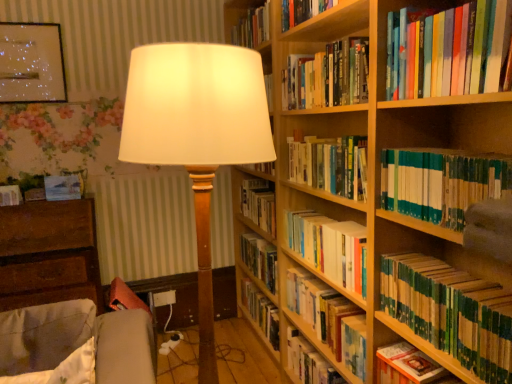
Question: Choose the correct answer: Is hardcover books at center, which is the fourth book in top-to-bottom order, inside wooden bookcase at right or outside it?

Choices:
 (A) inside
 (B) outside

Answer: (A)

Question: In terms of width, does hardcover books at center, which appears as the fifth book when ordered from the bottom, look wider or thinner when compared to wooden bookcase at right?

Choices:
 (A) wide
 (B) thin

Answer: (B)

Question: Which object is the farthest from the metallic silver frame at upper left?

Choices:
 (A) hardcover book at center, positioned as the 3th book in bottom-to-top order
 (B) hardcover book at upper right, the 1th book from the top
 (C) wooden bookcase at right
 (D) hardcover books at center, the seventh book positioned from the bottom
 (E) brown wooden chest of drawers at lower left

Answer: (B)

Question: Which object is the closest to the metallic silver frame at upper left?

Choices:
 (A) hardcover book at center, the 8th book viewed from the top
 (B) hardcover book at lower right, the seventh book in the top-to-bottom sequence
 (C) wooden bookcase at right
 (D) hardcover book at left, arranged as the 1th paperback book when viewed from the left
 (E) matte white lampshade at center

Answer: (D)